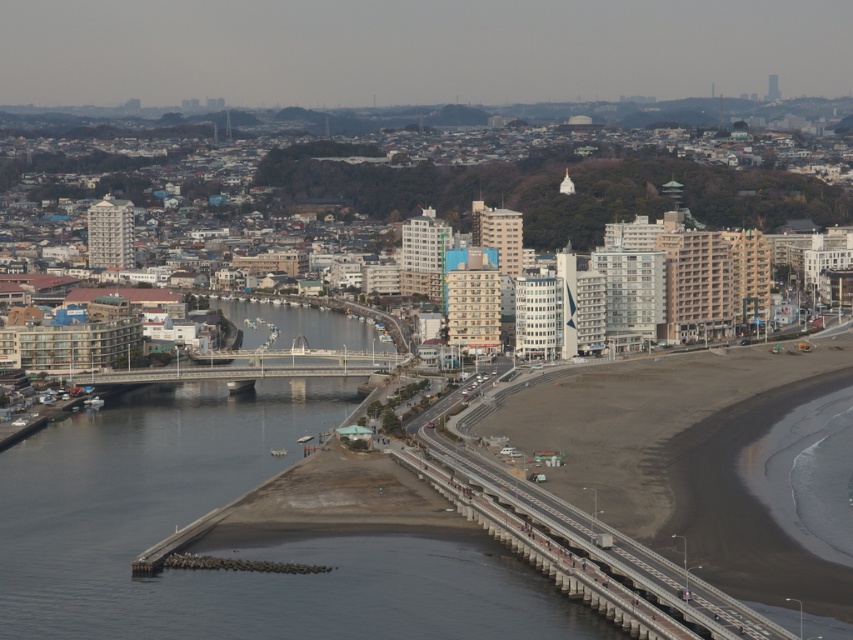
You are standing at the beach in the foreground of the coastal urban area. You see two points marked in the image. Which point, point (x=456, y=493) or point (x=292, y=308), is closer to you?

Point (x=456, y=493) is closer to you than point (x=292, y=308).

You are a city planner assessing the infrastructure of this coastal area. You notice two bridges in the scene. Which bridge, the concrete gray bridge at center or the smooth concrete bridge at center, would be more suitable for accommodating heavy cargo trucks based on their size?

The concrete gray bridge at center has a larger size compared to the smooth concrete bridge at center, making it more suitable for accommodating heavy cargo trucks due to its greater structural capacity.

You are a drone operator tasked with capturing aerial footage of the coastal urban area. You need to ensure the concrete bridge at lower center is centered in your shot. Given the bridge is located at coordinate point 0.872, 0.651, what adjustment should you make to the drone camera to frame it properly?

To center the concrete bridge at lower center, adjust the drone camera to focus on the coordinate point (x=554, y=557).